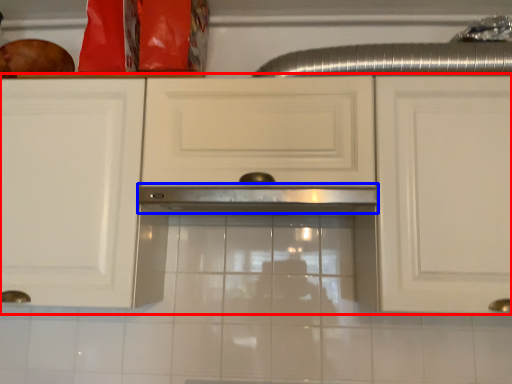
Question: Which of the following is the farthest to the observer, cabinetry (highlighted by a red box) or exhaust hood (highlighted by a blue box)?

Choices:
 (A) cabinetry
 (B) exhaust hood

Answer: (B)